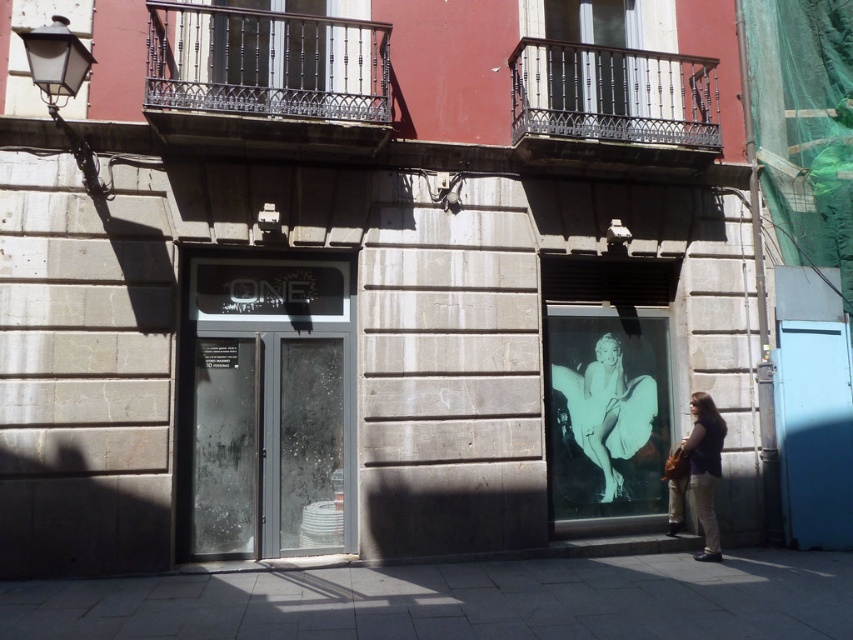
In the scene shown: You are a delivery person trying to park your 1.2 meter wide cart between the gray concrete pavement at lower center and the matte brown jacket at lower right. Can your cart fit in the space between them?

The gray concrete pavement at lower center is wider than the matte brown jacket at lower right. However, the exact width of the space between them is not provided, so it is uncertain if the 1.2 meter wide cart can fit.

You are standing in front of the building and want to walk to the gray concrete pavement at lower center. Based on the coordinates provided, can you determine if the pavement is positioned to your left, right, or directly ahead?

The gray concrete pavement at lower center is located at point coordinates, which places it directly ahead of your current position since the coordinates are centered horizontally.